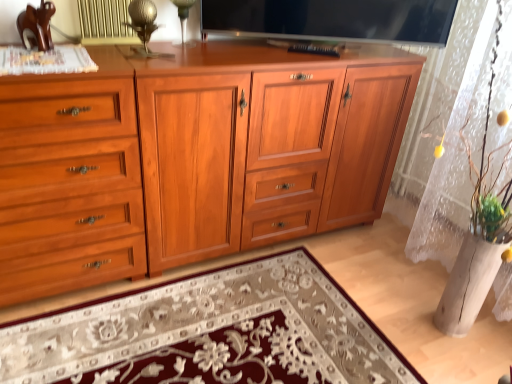
Identify the location of matte wood cupboard at left. (70, 181).

What do you see at coordinates (105, 22) in the screenshot?
I see `metallic gold radiator at upper center` at bounding box center [105, 22].

What are the coordinates of `shiny wood cabinet at center` in the screenshot? It's located at (195, 160).

What do you see at coordinates (144, 28) in the screenshot? The height and width of the screenshot is (384, 512). I see `metallic gold table lamp at upper center, which is the first table lamp in front-to-back order` at bounding box center [144, 28].

Locate an element on the screen. The height and width of the screenshot is (384, 512). matte wood cupboard at left is located at coordinates (70, 181).

Considering the sizes of objects flat screen tv at upper center and floral carpet at center in the image provided, who is thinner, flat screen tv at upper center or floral carpet at center?

flat screen tv at upper center is thinner.

Who is shorter, flat screen tv at upper center or floral carpet at center?

Standing shorter between the two is floral carpet at center.

Considering the positions of objects flat screen tv at upper center and floral carpet at center in the image provided, who is in front, flat screen tv at upper center or floral carpet at center?

floral carpet at center.

What are the coordinates of `mat on the left of flat screen tv at upper center` in the screenshot? It's located at (210, 333).

Does point (105, 0) come in front of point (387, 6)?

That is True.

How many degrees apart are the facing directions of metallic gold radiator at upper center and flat screen tv at upper center?

The angular difference between metallic gold radiator at upper center and flat screen tv at upper center is 29 degrees.

Is metallic gold radiator at upper center not inside flat screen tv at upper center?

Indeed, metallic gold radiator at upper center is completely outside flat screen tv at upper center.

Which object is closer to the camera, metallic gold radiator at upper center or flat screen tv at upper center?

metallic gold radiator at upper center is in front.

Considering the positions of objects transparent glass table lamp at upper center, positioned as the 2th table lamp in front-to-back order, and flat screen tv at upper center in the image provided, who is more to the left, transparent glass table lamp at upper center, positioned as the 2th table lamp in front-to-back order, or flat screen tv at upper center?

transparent glass table lamp at upper center, positioned as the 2th table lamp in front-to-back order.

From a real-world perspective, is transparent glass table lamp at upper center, the 1th table lamp positioned from the back, on top of flat screen tv at upper center?

No.

How different are the orientations of transparent glass table lamp at upper center, the 1th table lamp positioned from the back, and flat screen tv at upper center in degrees?

28.6 degrees separate the facing orientations of transparent glass table lamp at upper center, the 1th table lamp positioned from the back, and flat screen tv at upper center.

Which object is further away from the camera, shiny wood cabinet at center or matte wood cupboard at left?

shiny wood cabinet at center.

Would you say shiny wood cabinet at center is to the left or to the right of matte wood cupboard at left in the picture?

Clearly, shiny wood cabinet at center is on the right of matte wood cupboard at left in the image.

Who is shorter, shiny wood cabinet at center or matte wood cupboard at left?

Standing shorter between the two is matte wood cupboard at left.

Is flat screen tv at upper center with shiny wood cabinet at center?

No, flat screen tv at upper center is not touching shiny wood cabinet at center.

Is flat screen tv at upper center oriented towards shiny wood cabinet at center?

No, flat screen tv at upper center is not oriented towards shiny wood cabinet at center.

The height and width of the screenshot is (384, 512). Find the location of `television that appears above the shiny wood cabinet at center (from the image's perspective)`. television that appears above the shiny wood cabinet at center (from the image's perspective) is located at coordinates (333, 19).

Can you confirm if flat screen tv at upper center is positioned to the right of shiny wood cabinet at center?

Indeed, flat screen tv at upper center is positioned on the right side of shiny wood cabinet at center.

Between transparent glass table lamp at upper center, the 1th table lamp positioned from the back, and matte wood cupboard at left, which one has smaller width?

Thinner between the two is transparent glass table lamp at upper center, the 1th table lamp positioned from the back.

Is there a large distance between transparent glass table lamp at upper center, the 1th table lamp positioned from the back, and matte wood cupboard at left?

That's not correct — transparent glass table lamp at upper center, the 1th table lamp positioned from the back, is a little close to matte wood cupboard at left.

Is point (184, 3) farther from viewer compared to point (59, 133)?

Yes, point (184, 3) is behind point (59, 133).

Is transparent glass table lamp at upper center, the 1th table lamp positioned from the back, not within matte wood cupboard at left?

That's correct, transparent glass table lamp at upper center, the 1th table lamp positioned from the back, is outside of matte wood cupboard at left.

From a real-world perspective, does flat screen tv at upper center stand above matte wood cupboard at left?

Yes, from a real-world perspective, flat screen tv at upper center is above matte wood cupboard at left.

Considering the relative positions of flat screen tv at upper center and matte wood cupboard at left in the image provided, is flat screen tv at upper center to the right of matte wood cupboard at left from the viewer's perspective?

Yes.

The width and height of the screenshot is (512, 384). There is a matte wood cupboard at left. In order to click on television above it (from a real-world perspective) in this screenshot , I will do `click(333, 19)`.

Considering the relative sizes of flat screen tv at upper center and matte wood cupboard at left in the image provided, is flat screen tv at upper center thinner than matte wood cupboard at left?

Indeed, flat screen tv at upper center has a lesser width compared to matte wood cupboard at left.

Find the location of a particular element. The height and width of the screenshot is (384, 512). television behind the floral carpet at center is located at coordinates (333, 19).

At what (x,y) coordinates should I click in order to perform the action: click on radiator that is above the flat screen tv at upper center (from a real-world perspective). Please return your answer as a coordinate pair (x, y). Looking at the image, I should click on point(105,22).

When comparing their distances from shiny wood cabinet at center, does transparent glass table lamp at upper center, the 1th table lamp positioned from the back, or metallic gold table lamp at upper center, placed as the second table lamp when sorted from back to front, seem closer?

Based on the image, metallic gold table lamp at upper center, placed as the second table lamp when sorted from back to front, appears to be nearer to shiny wood cabinet at center.

Considering their positions, is metallic gold radiator at upper center positioned closer to flat screen tv at upper center than floral carpet at center?

metallic gold radiator at upper center is positioned closer to the anchor flat screen tv at upper center.

Considering their positions, is matte wood cupboard at left positioned further to metallic gold radiator at upper center than floral carpet at center?

The object further to metallic gold radiator at upper center is floral carpet at center.

Based on their spatial positions, is flat screen tv at upper center or transparent glass table lamp at upper center, positioned as the 2th table lamp in front-to-back order, closer to metallic gold table lamp at upper center, which is the first table lamp in front-to-back order?

transparent glass table lamp at upper center, positioned as the 2th table lamp in front-to-back order, lies closer to metallic gold table lamp at upper center, which is the first table lamp in front-to-back order, than the other object.

From the image, which object appears to be farther from metallic gold radiator at upper center, floral carpet at center or shiny wood cabinet at center?

floral carpet at center is positioned further to the anchor metallic gold radiator at upper center.

Which object lies further to the anchor point metallic gold radiator at upper center, floral carpet at center or transparent glass table lamp at upper center, the 1th table lamp positioned from the back?

floral carpet at center is further to metallic gold radiator at upper center.

Estimate the real-world distances between objects in this image. Which object is closer to transparent glass table lamp at upper center, the 1th table lamp positioned from the back, flat screen tv at upper center or matte wood cupboard at left?

flat screen tv at upper center is positioned closer to the anchor transparent glass table lamp at upper center, the 1th table lamp positioned from the back.

From the image, which object appears to be nearer to metallic gold radiator at upper center, matte wood cupboard at left or metallic gold table lamp at upper center, placed as the second table lamp when sorted from back to front?

metallic gold table lamp at upper center, placed as the second table lamp when sorted from back to front, is closer to metallic gold radiator at upper center.

At what (x,y) coordinates should I click in order to perform the action: click on cupboard that lies between flat screen tv at upper center and floral carpet at center from top to bottom. Please return your answer as a coordinate pair (x, y). Looking at the image, I should click on (70, 181).

Identify the location of cupboard between transparent glass table lamp at upper center, the 1th table lamp positioned from the back, and floral carpet at center from top to bottom. (70, 181).

Where is `table lamp between metallic gold table lamp at upper center, placed as the second table lamp when sorted from back to front, and shiny wood cabinet at center, in the horizontal direction`? Image resolution: width=512 pixels, height=384 pixels. table lamp between metallic gold table lamp at upper center, placed as the second table lamp when sorted from back to front, and shiny wood cabinet at center, in the horizontal direction is located at coordinates [184, 18].

Identify the location of chest of drawers between transparent glass table lamp at upper center, the 1th table lamp positioned from the back, and floral carpet at center in the up-down direction. The height and width of the screenshot is (384, 512). (195, 160).